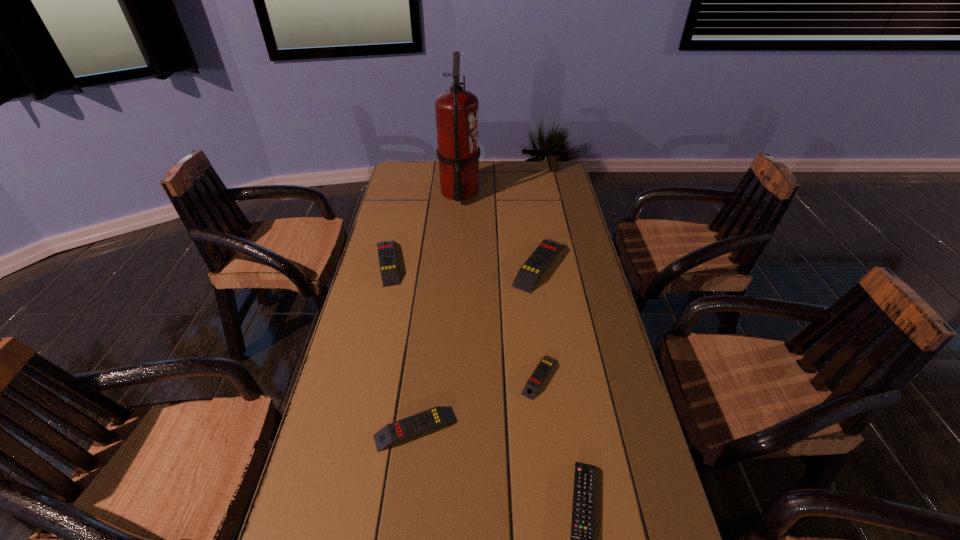
Find the location of a particular element. Image resolution: width=960 pixels, height=540 pixels. fire extinguisher is located at coordinates (457, 111).

This screenshot has width=960, height=540. I want to click on red fire extinguisher, so click(x=457, y=111).

The image size is (960, 540). Identify the location of the second tallest object. [552, 155].

I want to click on pistol, so click(x=552, y=155).

This screenshot has width=960, height=540. I want to click on the fifth shortest object, so click(531, 271).

You are a GUI agent. You are given a task and a screenshot of the screen. Output one action in this format:
    pyautogui.click(x=<x>, y=<y>)
    Task: Click on the biggest yellow remote control
    This screenshot has height=540, width=960.
    Given the screenshot: What is the action you would take?
    pyautogui.click(x=531, y=271)

At what (x,y) coordinates should I click in order to perform the action: click on the second biggest yellow remote control. Please return your answer as a coordinate pair (x, y). Image resolution: width=960 pixels, height=540 pixels. Looking at the image, I should click on (387, 259).

Image resolution: width=960 pixels, height=540 pixels. In order to click on the leftmost remote control in this screenshot , I will do click(387, 259).

Where is `the nearest yellow remote control`? the nearest yellow remote control is located at coordinates (414, 425).

Where is `the second nearest remote control`? the second nearest remote control is located at coordinates (414, 425).